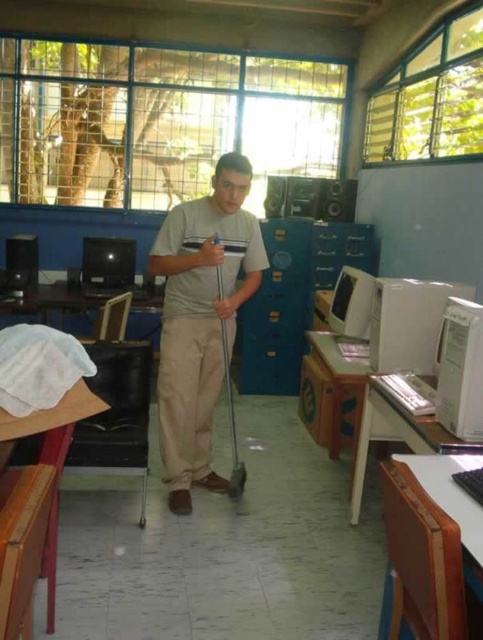
You are a student entering the classroom and notice the beige cotton pants at center and the matte black speaker at left. Which object is taller?

The beige cotton pants at center is taller than the matte black speaker at left.

You are a student trying to locate your teacher who is mopping the classroom floor. The teacher is wearing beige cotton pants at center. If you are standing at point 0.5, 0.5, which direction should you move to find the teacher?

The beige cotton pants at center are located at point (200, 317), which is slightly to the left and below your current position at (241, 320). Move left and down to reach the teacher.

You are a technician checking the computer lab. You need to access the white plastic computer tower at right and the shiny black monitor at center. Which one requires you to bend down more to reach?

The white plastic computer tower at right is below the shiny black monitor at center, so you will need to bend down more to reach the white plastic computer tower at right.